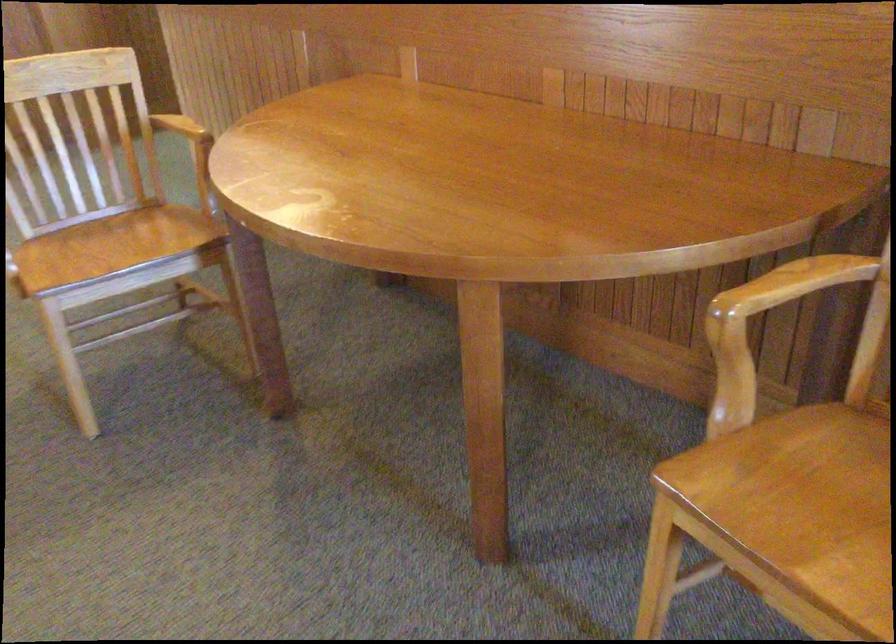
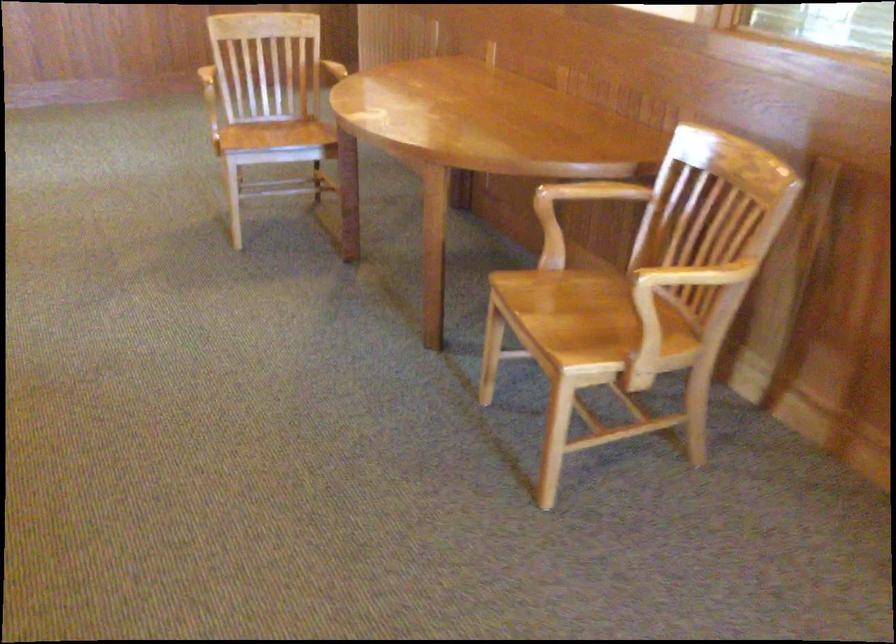
In the second image, find the point that corresponds to [777,295] in the first image.

(587, 194)